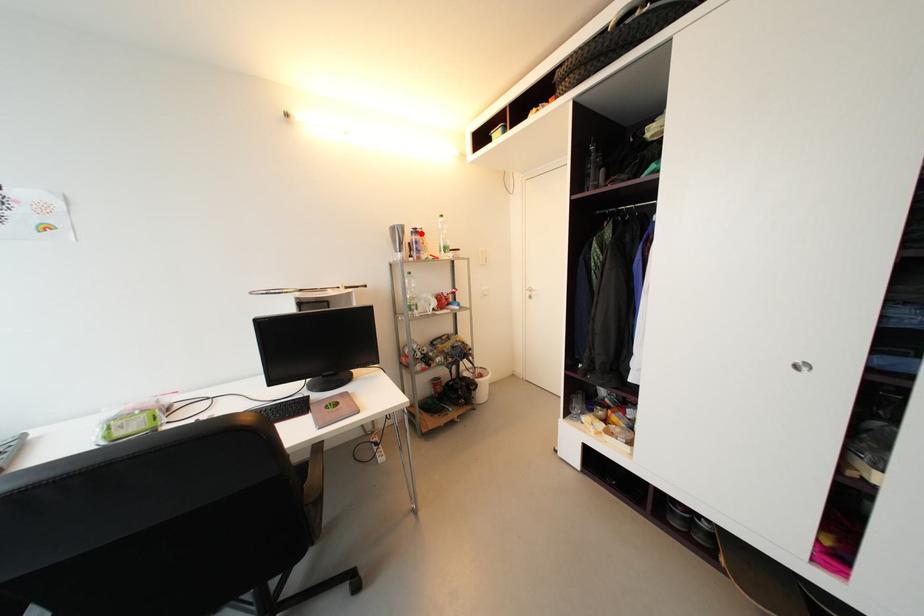
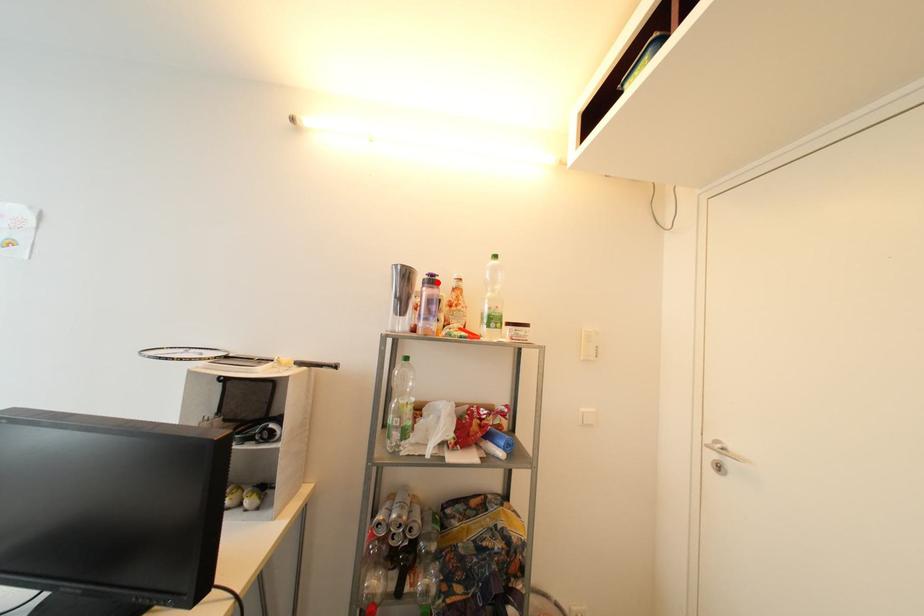
I am providing you with two images of the same scene from different viewpoints. A red point is marked on the first image and another point is marked on the second image. Is the red point in image1 aligned with the point shown in image2?

Yes